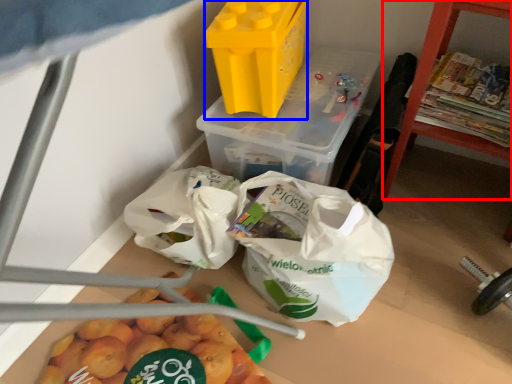
Question: Which point is further to the camera, furniture (highlighted by a red box) or yoghurt (highlighted by a blue box)?

Choices:
 (A) furniture
 (B) yoghurt

Answer: (B)